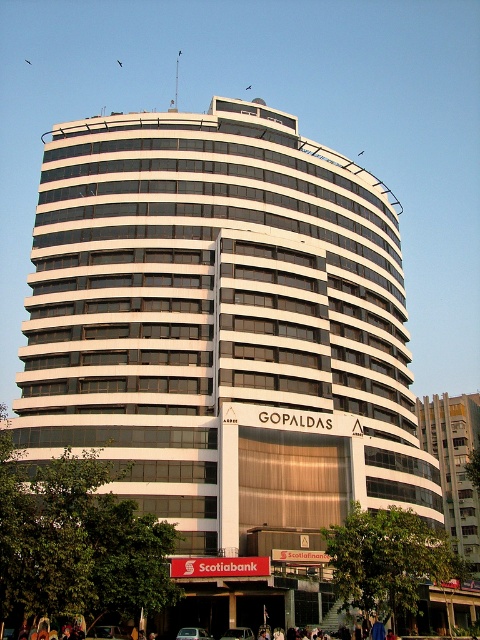
You are standing at the entrance of the Scotiabank branch below the name GOPALDAS. You see a point marked at coordinates (x=192, y=634). What object is located at that point?

The point at coordinates (x=192, y=634) corresponds to a silver metallic sedan at center.

You are a delivery driver approaching the building and need to park your vehicle. The parking spot you want is at coordinates point A. According to the image, where is the silver metallic sedan at center in relation to point A?

The silver metallic sedan at center is located at point A, so it is occupying the parking spot you want.

From the picture: You are a delivery person with a cart that is 1.5 meters wide. You need to navigate between the silver metallic sedan at center and the green matte car at center to reach the Scotiabank entrance. Is there enough space for your cart?

The distance between the silver metallic sedan at center and the green matte car at center is 1.87 meters. Since your cart is 1.5 meters wide, there is sufficient space to navigate between them as the gap is wider than the cart.